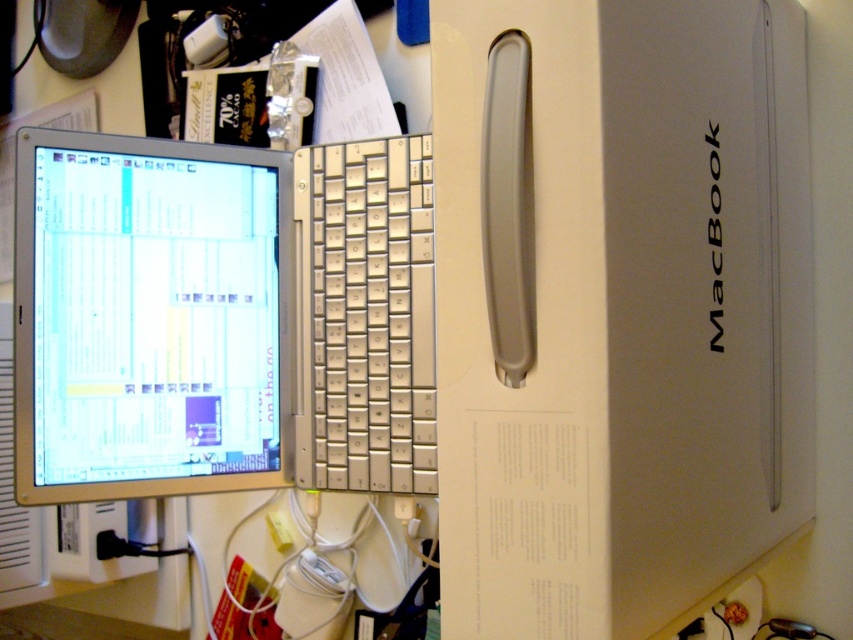
You are organizing your desk and need to place a new item between the silver metallic computer monitor at center and the silver metallic keyboard at center. Which object should you place the new item closer to if you want it to be near the smaller object?

The silver metallic keyboard at center is smaller than the silver metallic computer monitor at center, so you should place the new item closer to the silver metallic keyboard at center.

You are standing in front of the desk and want to reach two points on the desk. The first point is at coordinate point (x=15, y=424) and the second point is at coordinate point (x=357, y=221). Which point is closer to you?

Point (x=15, y=424) is closer to the viewer than point (x=357, y=221).